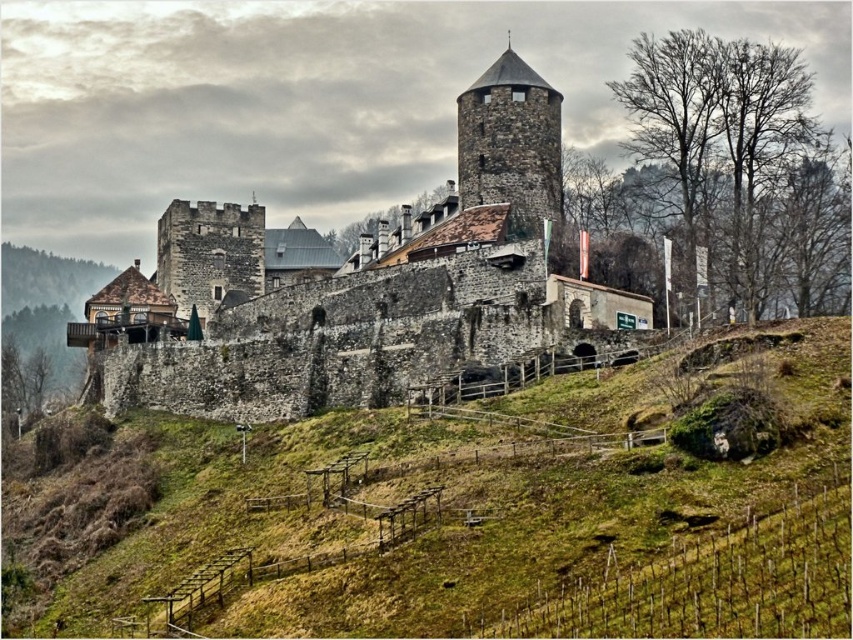
Question: Among these objects, which one is farthest from the camera?

Choices:
 (A) green grassy vineyard at lower center
 (B) rustic stone tower at center
 (C) stone wall at center

Answer: (B)

Question: Which is farther from the rustic stone tower at center?

Choices:
 (A) stone wall at center
 (B) green grassy vineyard at lower center

Answer: (B)

Question: Can you confirm if green grassy vineyard at lower center is positioned to the right of stone wall at center?

Choices:
 (A) yes
 (B) no

Answer: (A)

Question: Does stone wall at center have a larger size compared to rustic stone tower at center?

Choices:
 (A) yes
 (B) no

Answer: (A)

Question: Does green grassy vineyard at lower center have a lesser width compared to rustic stone tower at center?

Choices:
 (A) yes
 (B) no

Answer: (B)

Question: Which point is closer to the camera taking this photo?

Choices:
 (A) [x=257, y=364]
 (B) [x=293, y=609]
 (C) [x=459, y=198]

Answer: (B)